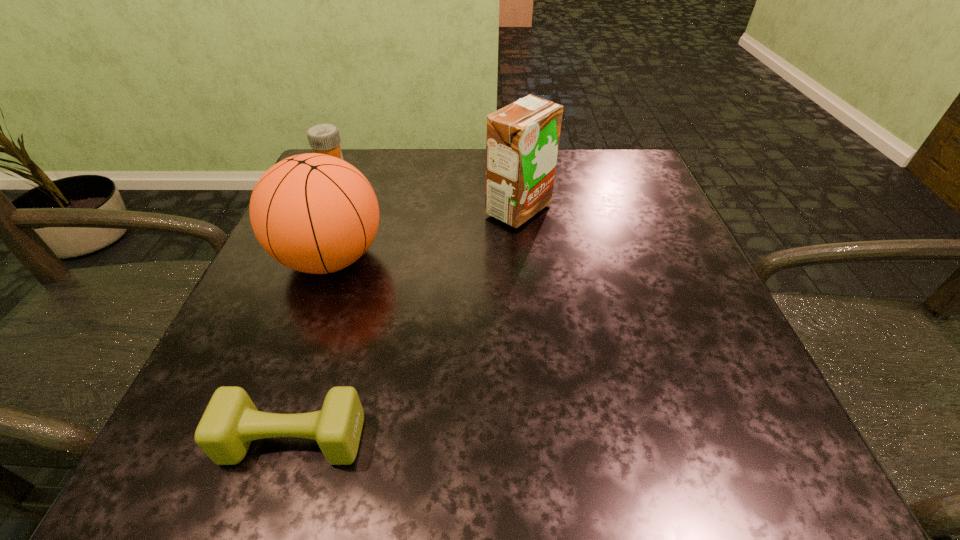
At what (x,y) coordinates should I click in order to perform the action: click on vacant region at the far edge. Please return your answer as a coordinate pair (x, y). The width and height of the screenshot is (960, 540). Looking at the image, I should click on (398, 166).

The width and height of the screenshot is (960, 540). Identify the location of vacant area at the near edge. (560, 473).

This screenshot has width=960, height=540. In order to click on vacant area at the left edge of the desktop in this screenshot , I will do `click(234, 374)`.

Locate an element on the screen. The width and height of the screenshot is (960, 540). free space at the right edge of the desktop is located at coordinates (648, 235).

In the image, there is a desktop. Identify the location of free region at the near left corner. (277, 468).

Locate an element on the screen. Image resolution: width=960 pixels, height=540 pixels. blank space at the far right corner of the desktop is located at coordinates (619, 187).

Where is `vacant point located between the third tallest object and the rightmost object`? vacant point located between the third tallest object and the rightmost object is located at coordinates (425, 191).

The height and width of the screenshot is (540, 960). Find the location of `vacant area that lies between the carton and the shortest object`. vacant area that lies between the carton and the shortest object is located at coordinates (406, 325).

You are a GUI agent. You are given a task and a screenshot of the screen. Output one action in this format:
    pyautogui.click(x=<x>, y=<y>)
    Task: Click on the free space between the basketball and the carton
    This screenshot has height=540, width=960.
    Given the screenshot: What is the action you would take?
    pyautogui.click(x=424, y=234)

Where is `empty space between the carton and the basketball`? empty space between the carton and the basketball is located at coordinates (424, 234).